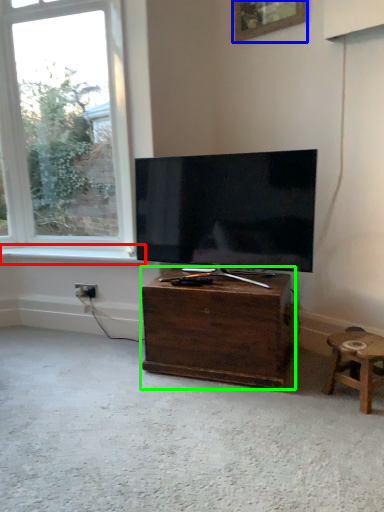
Question: Considering the real-world distances, which object is closest to window sill (highlighted by a red box)? picture frame (highlighted by a blue box) or nightstand (highlighted by a green box).

Choices:
 (A) picture frame
 (B) nightstand

Answer: (B)